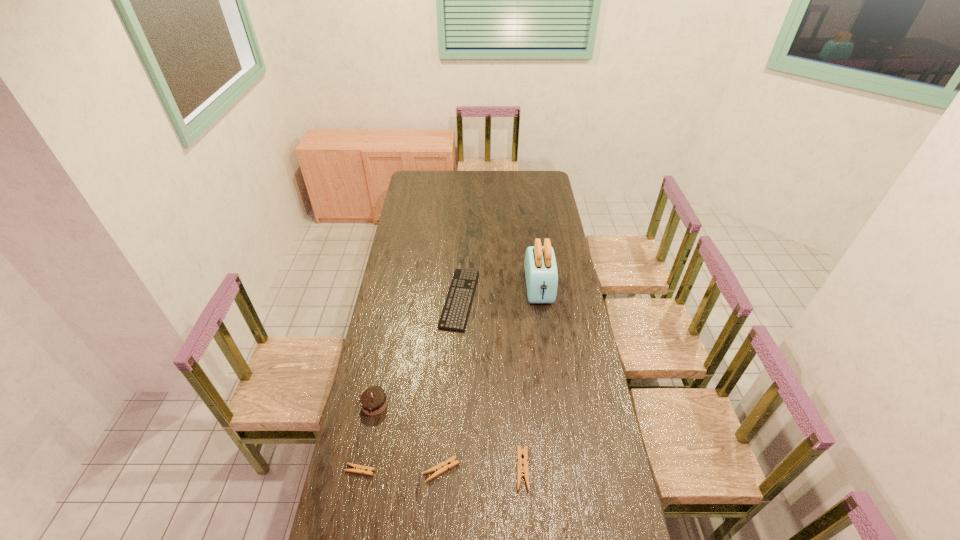
Find the location of a particular element. This screenshot has width=960, height=540. the leftmost clothespin is located at coordinates (360, 469).

I want to click on the second clothespin from right to left, so click(438, 469).

At what (x,y) coordinates should I click in order to perform the action: click on the second object from right to left. Please return your answer as a coordinate pair (x, y). Looking at the image, I should click on (522, 471).

Locate an element on the screen. This screenshot has width=960, height=540. the fourth shortest object is located at coordinates (522, 471).

At what (x,y) coordinates should I click in order to perform the action: click on computer keyboard. Please return your answer as a coordinate pair (x, y). This screenshot has height=540, width=960. Looking at the image, I should click on (454, 315).

This screenshot has width=960, height=540. Find the location of `the tallest object`. the tallest object is located at coordinates (541, 272).

I want to click on toaster, so click(541, 272).

Image resolution: width=960 pixels, height=540 pixels. What are the coordinates of `the second tallest object` in the screenshot? It's located at (373, 400).

The image size is (960, 540). What are the coordinates of `the third farthest object` in the screenshot? It's located at (373, 400).

This screenshot has width=960, height=540. Identify the location of vacant area situated on the back of the shortest clothespin. (378, 377).